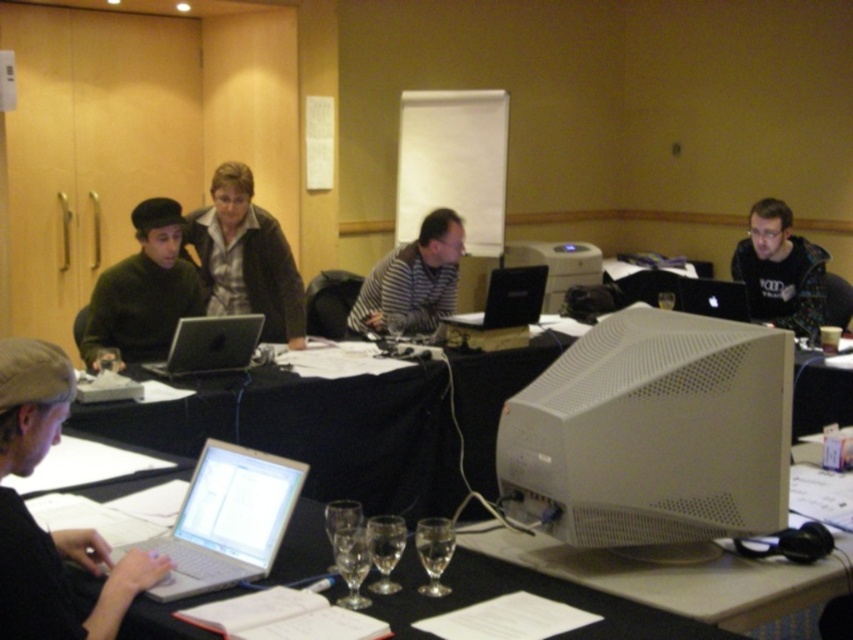
Is silver metallic laptop at left in front of clear glass wine glass at lower center?

No, silver metallic laptop at left is behind clear glass wine glass at lower center.

Can you confirm if silver metallic laptop at left is thinner than clear glass wine glass at lower center?

No.

This screenshot has height=640, width=853. Find the location of `silver metallic laptop at left`. silver metallic laptop at left is located at coordinates (210, 346).

Does point (436, 296) lie in front of point (323, 529)?

No.

Does striped sweater at center have a greater width compared to clear glass at center?

Yes, striped sweater at center is wider than clear glass at center.

Is point (436, 216) more distant than point (339, 516)?

Yes, point (436, 216) is farther from viewer.

Identify the location of striped sweater at center. (412, 280).

Between white matte desktop computer at center and transparent glass at center, which one is positioned higher?

white matte desktop computer at center is above.

Based on the photo, does white matte desktop computer at center appear on the left side of transparent glass at center?

In fact, white matte desktop computer at center is to the right of transparent glass at center.

Locate an element on the screen. white matte desktop computer at center is located at coordinates (653, 433).